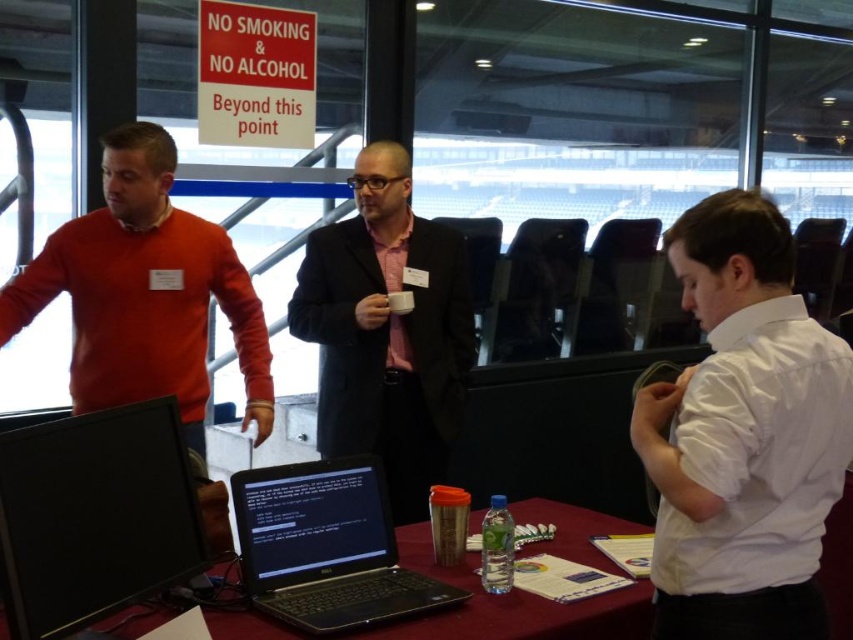
Question: Which object is closer to the camera taking this photo?

Choices:
 (A) metallic silver laptop at center
 (B) black glossy monitor at lower left
 (C) black plastic laptop at center
 (D) pink satin shirt at center

Answer: (B)

Question: Which object appears farthest from the camera in this image?

Choices:
 (A) pink satin shirt at center
 (B) metallic silver laptop at center

Answer: (A)

Question: Does black glossy monitor at lower left have a greater width compared to metallic silver laptop at center?

Choices:
 (A) no
 (B) yes

Answer: (A)

Question: Which of the following is the closest to the observer?

Choices:
 (A) [x=167, y=419]
 (B) [x=367, y=150]

Answer: (A)

Question: Can you confirm if pink satin shirt at center is bigger than black glossy monitor at lower left?

Choices:
 (A) yes
 (B) no

Answer: (A)

Question: Can you confirm if pink satin shirt at center is wider than black glossy monitor at lower left?

Choices:
 (A) yes
 (B) no

Answer: (A)